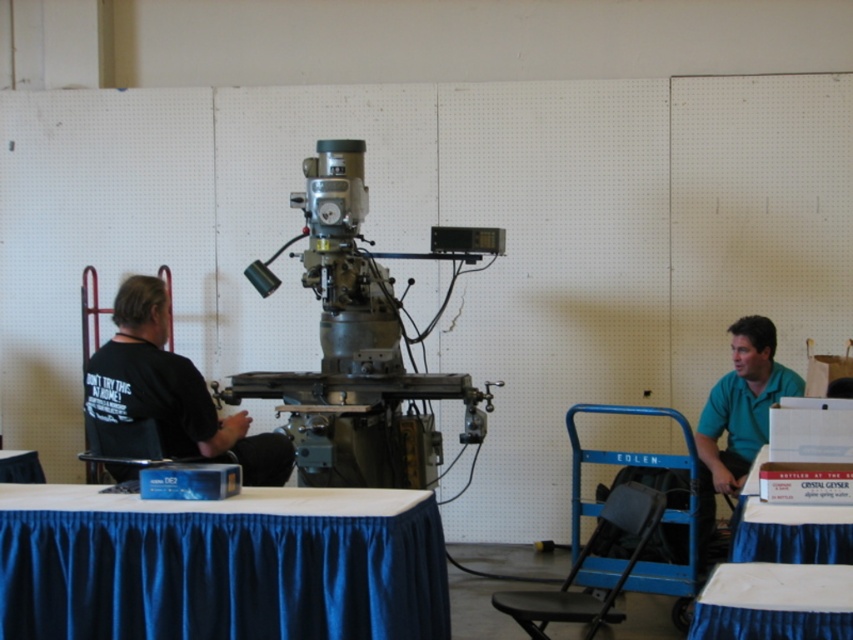
Question: Which of the following is the farthest from the observer?

Choices:
 (A) (15, 465)
 (B) (4, 557)
 (C) (756, 547)

Answer: (A)

Question: Which of the following is the farthest from the observer?

Choices:
 (A) pos(838,532)
 (B) pos(380,372)
 (C) pos(154,513)
 (D) pos(767,600)

Answer: (B)

Question: Which is nearer to the green matte shirt at right?

Choices:
 (A) metallic gray machine at center
 (B) blue fabric table at lower right

Answer: (B)

Question: Is blue fabric table at lower right smaller than blue fabric table at lower left?

Choices:
 (A) yes
 (B) no

Answer: (B)

Question: In this image, where is metallic gray machine at center located relative to green matte shirt at right?

Choices:
 (A) left
 (B) right

Answer: (A)

Question: Is white glossy table at lower right wider than blue fabric table at lower left?

Choices:
 (A) yes
 (B) no

Answer: (A)